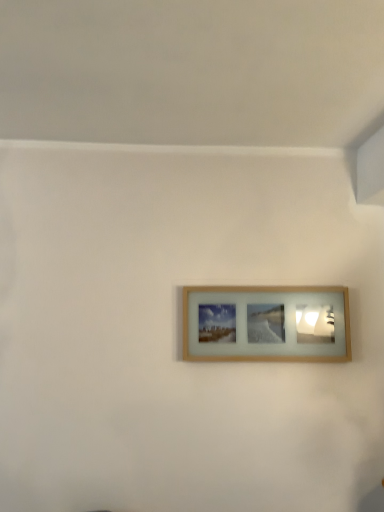
Question: Should I look upward or downward to see wooden picture frame at center?

Choices:
 (A) up
 (B) down

Answer: (B)